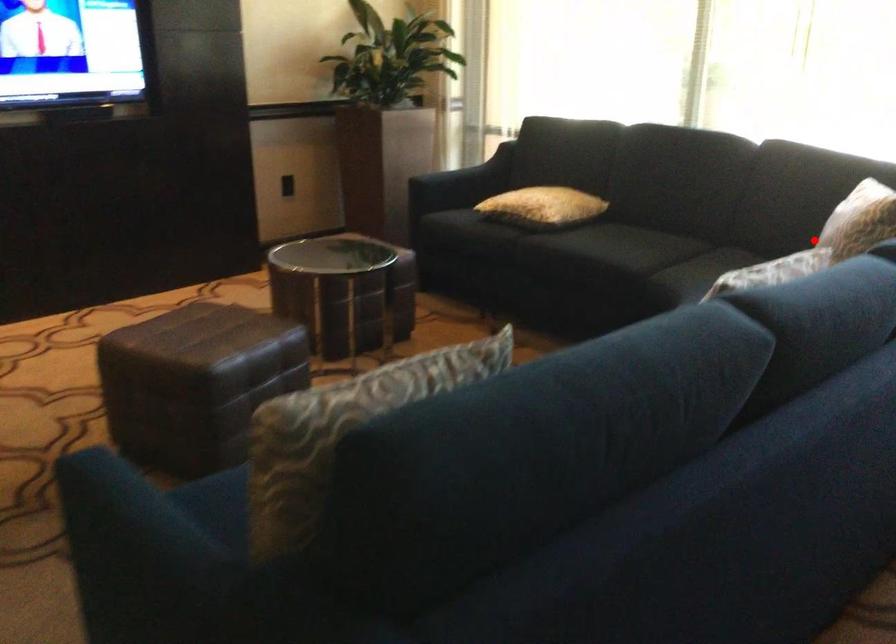
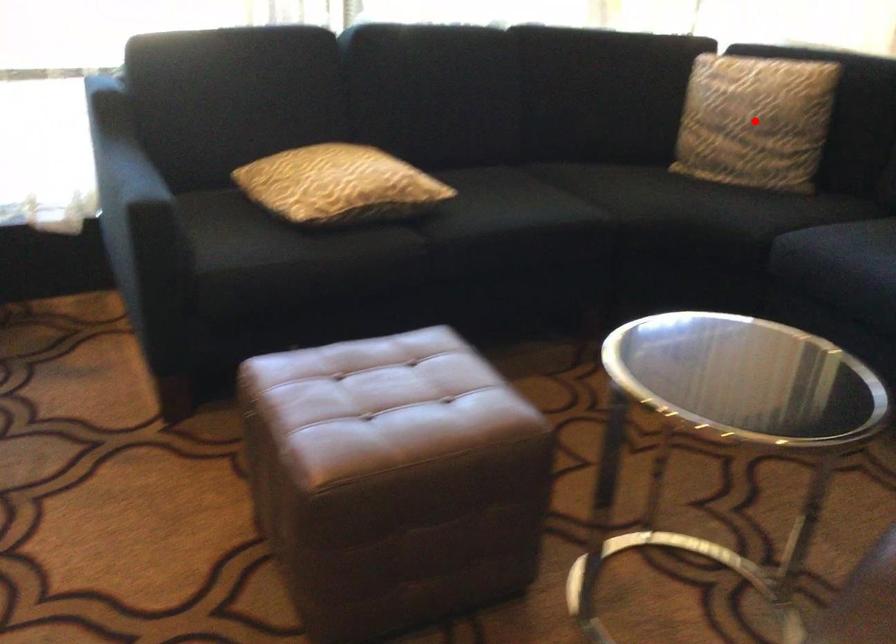
I am providing you with two images of the same scene from different viewpoints. A red point is marked on the first image and another point is marked on the second image. Does the point marked in image1 correspond to the same location as the one in image2?

Yes